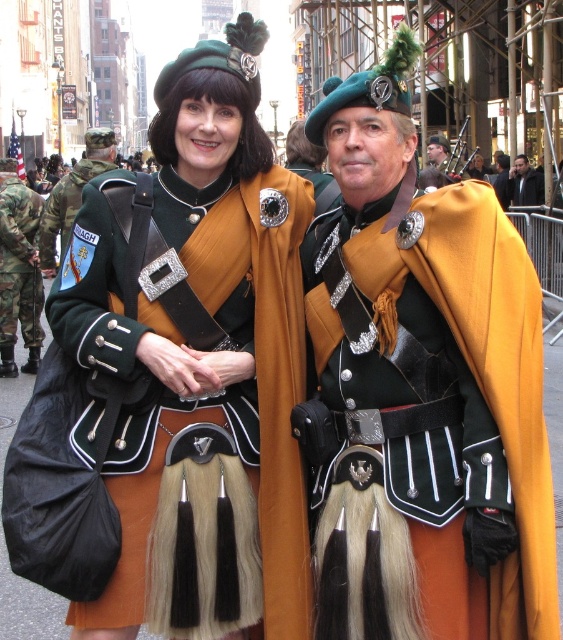
Is point (542, 600) positioned in front of point (55, 269)?

That is True.

This screenshot has width=563, height=640. I want to click on gold matte cape at center, so click(486, 365).

Can you confirm if matte black kilt at center is shorter than camouflage fabric pants at left?

Incorrect, matte black kilt at center's height does not fall short of camouflage fabric pants at left's.

Does point (133, 460) come farther from viewer compared to point (21, 275)?

No, it is not.

Does point (240, 586) come farther from viewer compared to point (3, 209)?

No.

Locate an element on the screen. Image resolution: width=563 pixels, height=640 pixels. matte black kilt at center is located at coordinates (200, 336).

Between gold matte cape at center and dark brown fur coat at center, which one appears on the right side from the viewer's perspective?

From the viewer's perspective, dark brown fur coat at center appears more on the right side.

Can you confirm if gold matte cape at center is wider than dark brown fur coat at center?

Indeed, gold matte cape at center has a greater width compared to dark brown fur coat at center.

The width and height of the screenshot is (563, 640). I want to click on gold matte cape at center, so click(x=486, y=365).